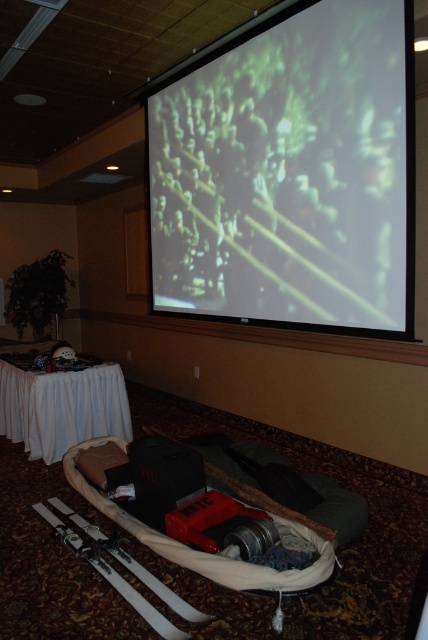
Measure the distance between point (412, 163) and camera.

The distance of point (412, 163) from camera is 7.19 feet.

Is matte white screen at upper center taller than white cloth table at lower left?

Yes.

Is point (312, 147) closer to viewer compared to point (38, 442)?

Yes, point (312, 147) is closer to viewer.

The height and width of the screenshot is (640, 428). Identify the location of matte white screen at upper center. (290, 172).